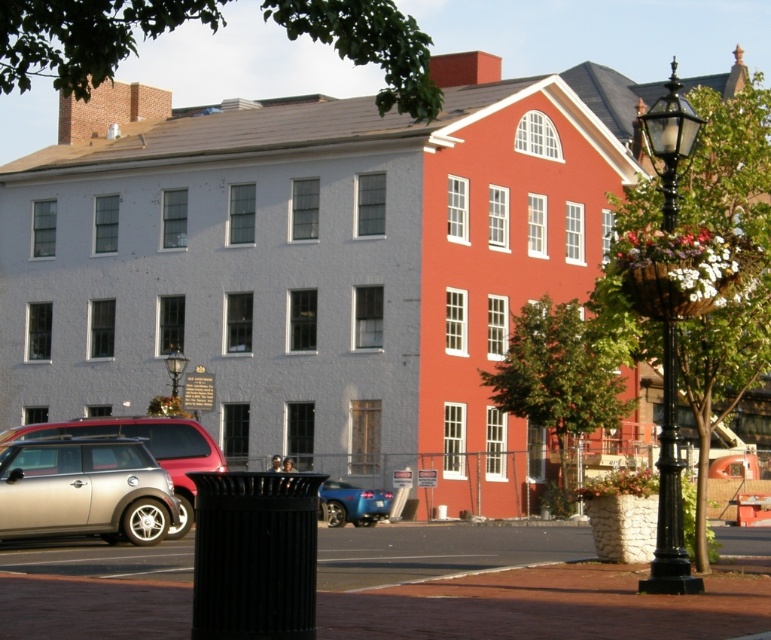
You are a delivery person needing to park your 15 feet long glossy blue car at center in a spot that is exactly 30 feet away from the black glass lamp post at center. Based on the scene provided, can you park your car in the available space between the two buildings without exceeding the 30 feet distance requirement?

Result: The distance between the glossy blue car at center and the black glass lamp post at center is 40.31 feet. Since the required parking distance is 30 feet, the car is currently parked 10.31 feet beyond the allowed limit. Therefore, you cannot park the glossy blue car at center within the 30 feet requirement.

You are a delivery person standing at point (359, 490) and need to deliver a package to point (642, 115). The delivery path must stay within the paved area in front of the two buildings. Is the path from your current position to the delivery point clear of any obstacles?

Point (642, 115) is behind point (359, 490), so the path between them might be blocked by the buildings or other structures. You should check for any obstacles in the paved area before proceeding.

You are a delivery driver who needs to park your vehicle in this area. You have a truck that is 1.8 meters tall. Can you safely park your truck between the silver metallic car at lower left and the glossy blue car at center without hitting the roof?

The silver metallic car at lower left is taller than the glossy blue car at center. Since the truck is 1.8 meters tall, and the silver metallic car at lower left is taller, it is possible that the height clearance between them is sufficient. However, without knowing the exact height of the silver metallic car, it is uncertain if the truck can safely park there without hitting the roof.